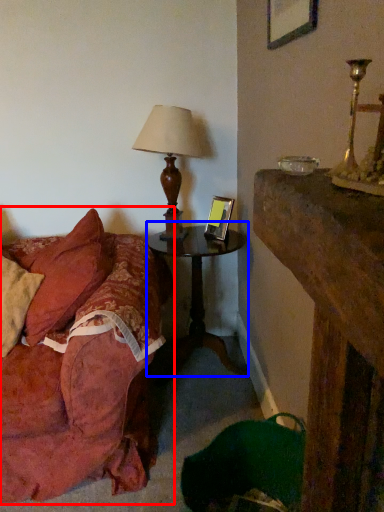
Question: Which of the following is the farthest to the observer, studio couch (highlighted by a red box) or nightstand (highlighted by a blue box)?

Choices:
 (A) studio couch
 (B) nightstand

Answer: (B)